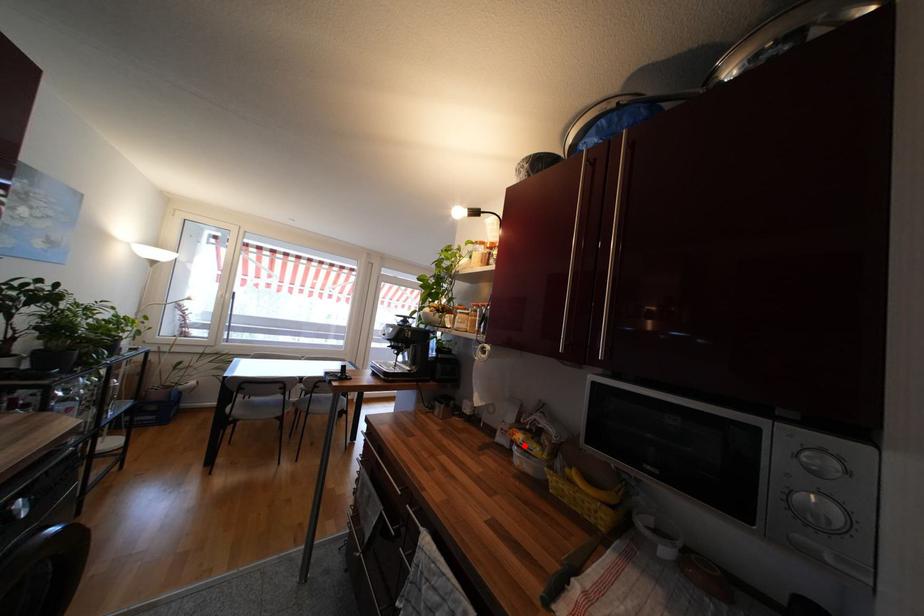
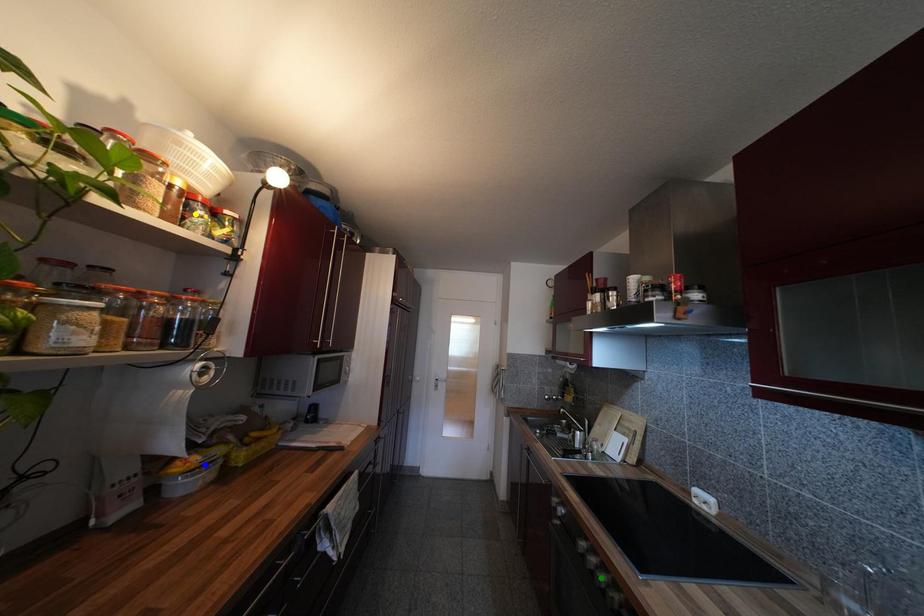
Question: I am providing you with two images of the same scene from different viewpoints. A red point is marked on the first image. You are given multiple points on the second image. In image 2, which mark is for the same physical point as the one in image 1?

Choices:
 (A) blue point
 (B) green point
 (C) yellow point

Answer: (A)